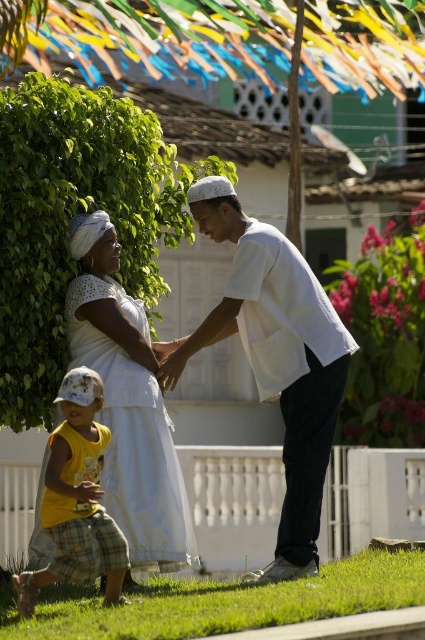
Describe the element at coordinates (127, 403) in the screenshot. Image resolution: width=425 pixels, height=640 pixels. I see `white cotton dress at center` at that location.

Where is `white cotton dress at center`? This screenshot has height=640, width=425. white cotton dress at center is located at coordinates (127, 403).

Which is below, green leafy tree at upper left or green grass at lower center?

green grass at lower center

Does point (81, 164) come in front of point (413, 573)?

No, (81, 164) is behind (413, 573).

Identify the location of green leafy tree at upper left. (73, 216).

Is white cotton shirt at center above white cotton dress at center?

Indeed, white cotton shirt at center is positioned over white cotton dress at center.

The width and height of the screenshot is (425, 640). In order to click on white cotton shirt at center in this screenshot , I will do `click(275, 358)`.

Image resolution: width=425 pixels, height=640 pixels. Identify the location of white cotton shirt at center. (275, 358).